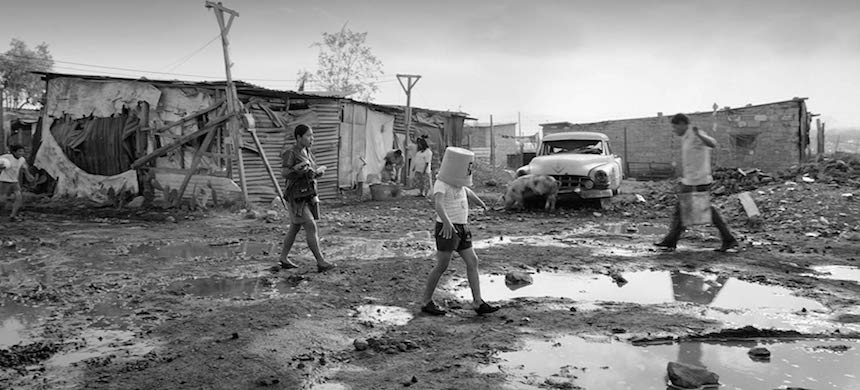
Where is `homes`? The width and height of the screenshot is (860, 390). homes is located at coordinates (327, 123), (228, 122), (169, 118), (81, 103), (372, 125), (418, 123), (645, 148), (765, 137).